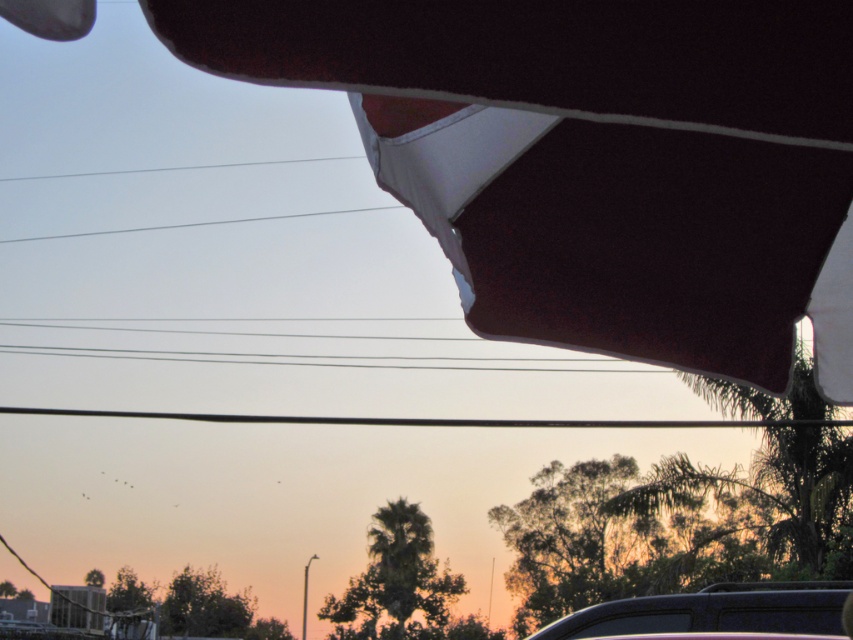
You are a photographer standing at the camera position in the scene. You want to place a small tripod to capture the black wire at center. What is the minimum length of the tripod legs needed to ensure the camera is above the ground?

The minimum length of the tripod legs needed is 14.27 feet to ensure the camera is above the ground since the black wire at center is 14.27 feet away from the camera.

You are standing at the center of the image and notice a shiny black car at lower right and a black wire at center. Which object is closer to your current position?

The black wire at center is closer to your current position because it is located at the center, while the shiny black car at lower right is positioned to the right of it.

You are a photographer trying to capture the clear wire at upper center in your shot. You have a shiny black car at lower right in your current frame. Since the wire is important, should you adjust your camera angle to exclude the car?

The shiny black car at lower right has a smaller size compared to clear wire at upper center, so the car is smaller than the wire. Since the wire is more important, you can adjust your angle to exclude the car without losing the wire in the frame.